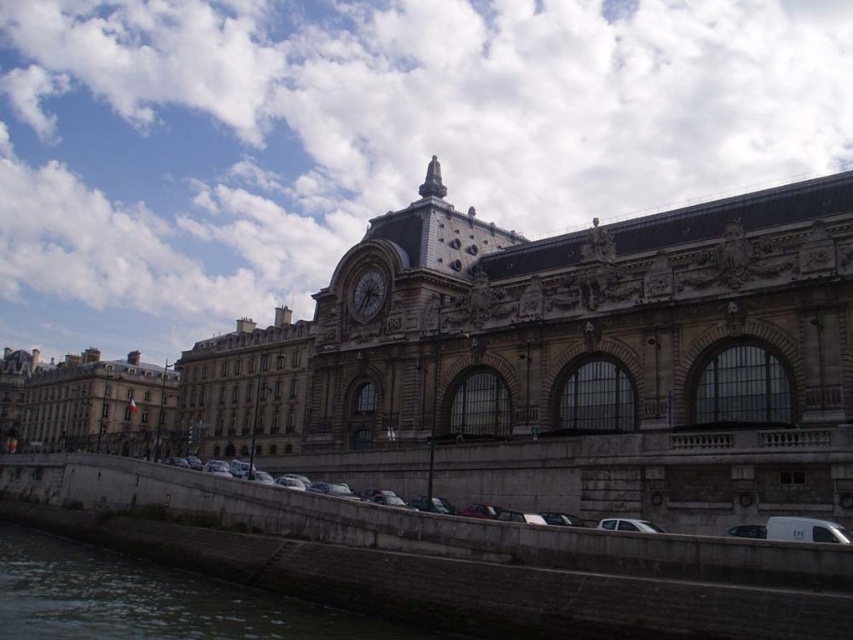
Question: Is stone clock tower at center bigger than dark gray concrete at lower left?

Choices:
 (A) no
 (B) yes

Answer: (B)

Question: Is stone clock tower at center bigger than dark gray stone clock at center?

Choices:
 (A) yes
 (B) no

Answer: (A)

Question: Is dark gray concrete at lower left smaller than dark gray stone clock at center?

Choices:
 (A) yes
 (B) no

Answer: (B)

Question: Which point appears closest to the camera in this image?

Choices:
 (A) (22, 387)
 (B) (80, 573)
 (C) (316, 362)

Answer: (B)

Question: Which point is farther to the camera?

Choices:
 (A) (45, 620)
 (B) (126, 419)
 (C) (849, 218)
 (D) (349, 307)

Answer: (B)

Question: Which is nearer to the dark gray stone clock at center?

Choices:
 (A) stone building at left
 (B) stone clock tower at center

Answer: (B)